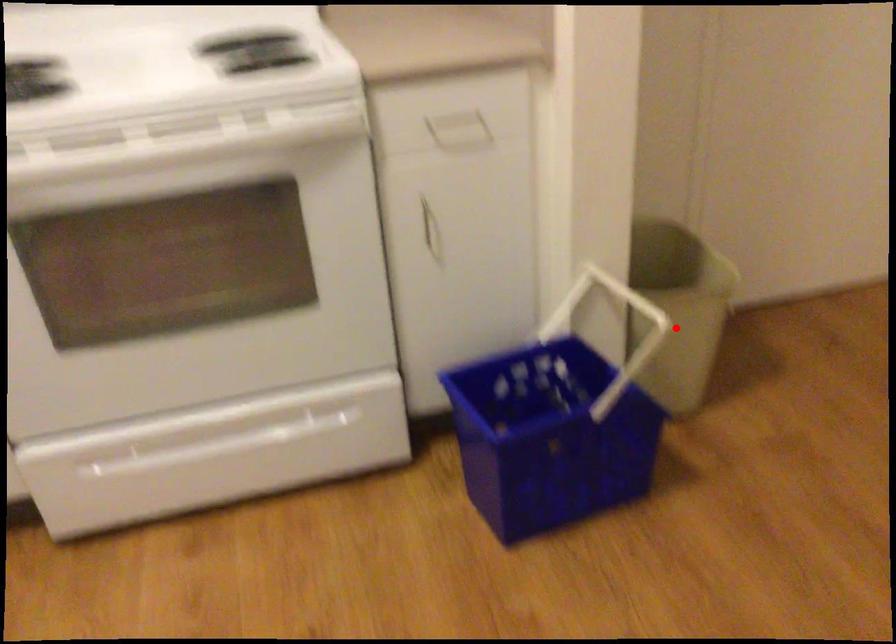
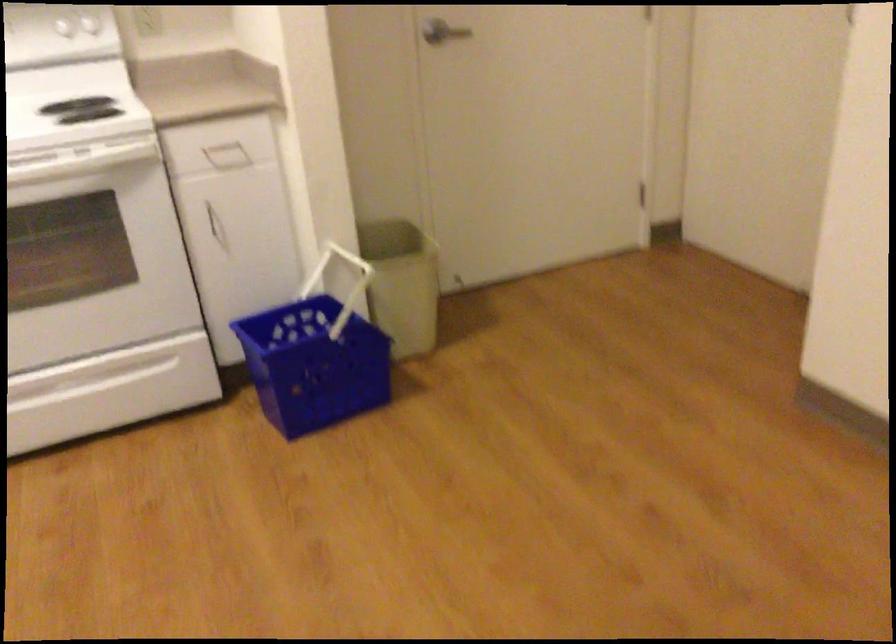
Question: A red point is marked in image1. In image2, is the corresponding 3D point closer to the camera or farther? Reply with the corresponding letter.

Choices:
 (A) The corresponding 3D point is closer.
 (B) The corresponding 3D point is farther.

Answer: (B)